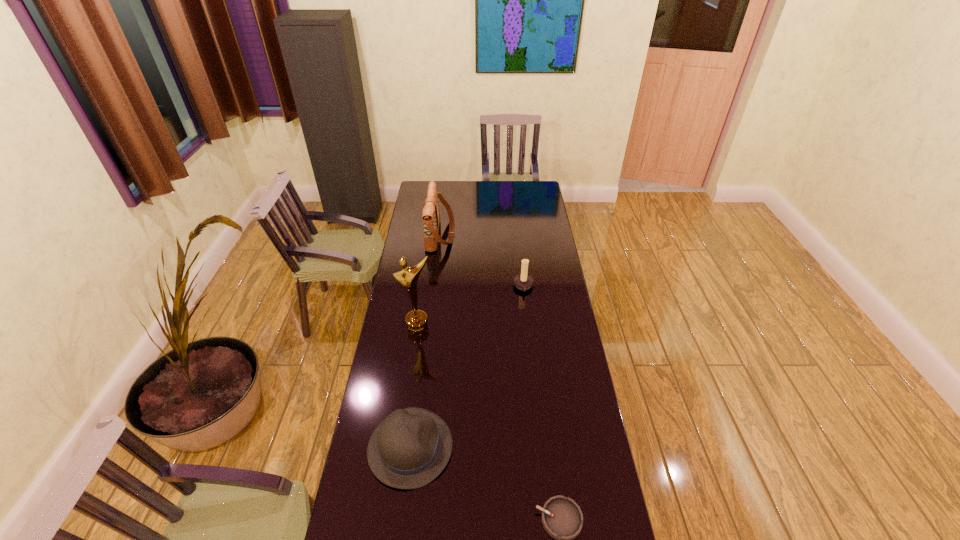
The image size is (960, 540). I want to click on free space that satisfies the following two spatial constraints: 1. on the wick of the candle holder; 2. on the front-facing side of the tallest object, so click(528, 327).

Identify the location of vacant region that satisfies the following two spatial constraints: 1. on the front-facing side of the farthest object; 2. on the front-facing side of the award. The image size is (960, 540). (430, 327).